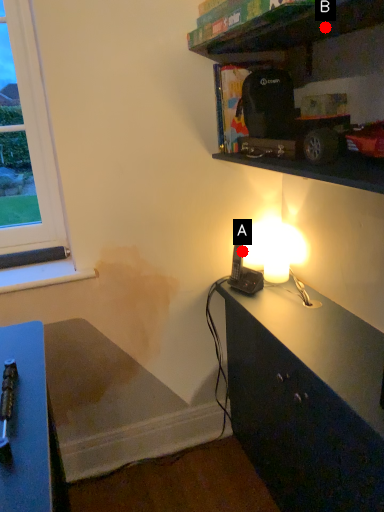
Question: Two points are circled on the image, labeled by A and B beside each circle. Which point is farther to the camera?

Choices:
 (A) A is further
 (B) B is further

Answer: (A)